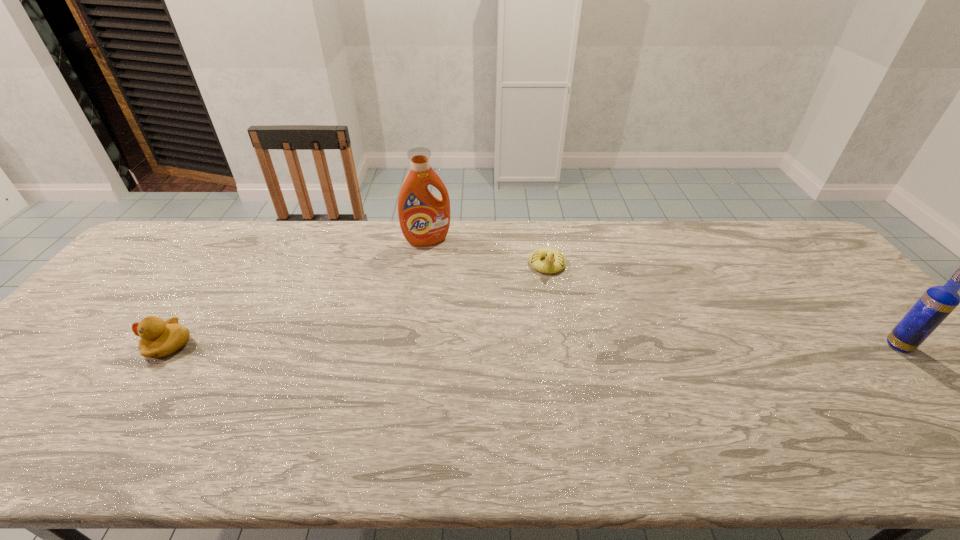
This screenshot has width=960, height=540. I want to click on free spot between the detergent and the right duckling, so click(x=488, y=253).

This screenshot has height=540, width=960. In order to click on free space between the detergent and the vodka in this screenshot , I will do `click(663, 293)`.

In order to click on free spot between the third shortest object and the detergent in this screenshot , I will do `click(663, 293)`.

Locate an element on the screen. unoccupied position between the vodka and the detergent is located at coordinates (663, 293).

Where is `free space between the vodka and the second object from left to right`? free space between the vodka and the second object from left to right is located at coordinates (663, 293).

Find the location of a particular element. The image size is (960, 540). vacant space in between the third object from right to left and the nearer duckling is located at coordinates (299, 293).

Locate an element on the screen. Image resolution: width=960 pixels, height=540 pixels. free space between the third object from left to right and the vodka is located at coordinates (723, 305).

This screenshot has height=540, width=960. I want to click on the third closest object relative to the taller duckling, so click(934, 306).

Point out which object is positioned as the second nearest to the right duckling. Please provide its 2D coordinates. Your answer should be formatted as a tuple, i.e. [(x, y)], where the tuple contains the x and y coordinates of a point satisfying the conditions above.

[(934, 306)]

Locate an element on the screen. The image size is (960, 540). free point that satisfies the following two spatial constraints: 1. on the front side of the second tallest object; 2. on the right side of the third nearest object is located at coordinates (562, 346).